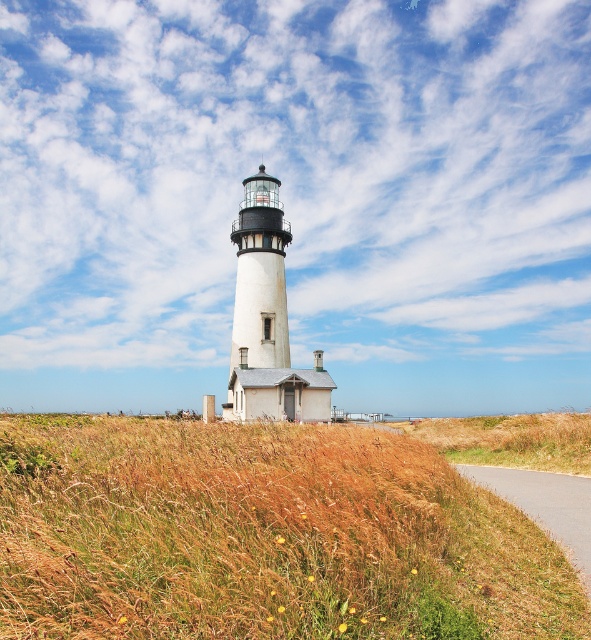
Question: Among these objects, which one is farthest from the camera?

Choices:
 (A) asphalt road at lower right
 (B) brown dry grass at lower center

Answer: (A)

Question: Which object appears farthest from the camera in this image?

Choices:
 (A) brown dry grass at lower center
 (B) asphalt road at lower right

Answer: (B)

Question: Can you confirm if brown dry grass at lower center is positioned to the left of asphalt road at lower right?

Choices:
 (A) yes
 (B) no

Answer: (A)

Question: Which object is closer to the camera taking this photo?

Choices:
 (A) brown dry grass at lower center
 (B) asphalt road at lower right

Answer: (A)

Question: Is brown dry grass at lower center positioned behind asphalt road at lower right?

Choices:
 (A) yes
 (B) no

Answer: (B)

Question: Is brown dry grass at lower center to the right of asphalt road at lower right from the viewer's perspective?

Choices:
 (A) yes
 (B) no

Answer: (B)